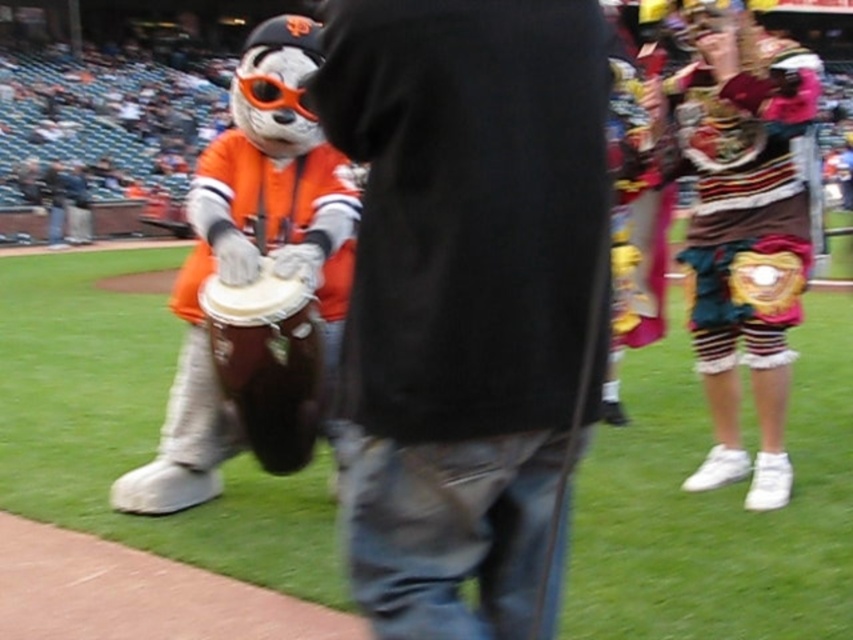
Is black cotton shirt at center below striped fabric shorts at center?

Yes, black cotton shirt at center is below striped fabric shorts at center.

The width and height of the screenshot is (853, 640). Identify the location of black cotton shirt at center. (463, 291).

The width and height of the screenshot is (853, 640). In order to click on black cotton shirt at center in this screenshot , I will do `click(463, 291)`.

Between striped fabric shorts at center and orange fabric mascot at left, which one appears on the right side from the viewer's perspective?

striped fabric shorts at center

Is striped fabric shorts at center positioned before orange fabric mascot at left?

No, it is behind orange fabric mascot at left.

Is point (744, 241) behind point (334, 276)?

No, it is in front of (334, 276).

Locate an element on the screen. striped fabric shorts at center is located at coordinates (741, 225).

Who is positioned more to the left, black cotton shirt at center or orange fabric mascot at left?

From the viewer's perspective, orange fabric mascot at left appears more on the left side.

Does black cotton shirt at center have a smaller size compared to orange fabric mascot at left?

Yes.

Identify the location of black cotton shirt at center. (463, 291).

Find the location of a particular element. black cotton shirt at center is located at coordinates (463, 291).